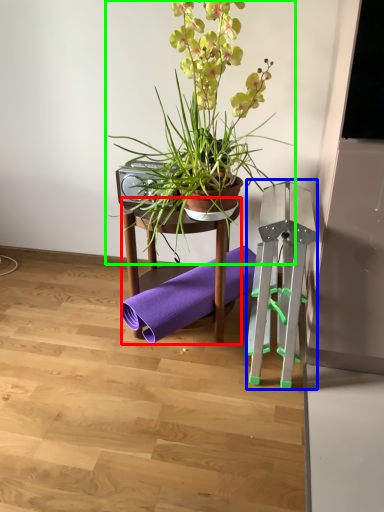
Question: Which object is the farthest from furniture (highlighted by a red box)? Choose among these: easel (highlighted by a blue box) or houseplant (highlighted by a green box).

Choices:
 (A) easel
 (B) houseplant

Answer: (A)